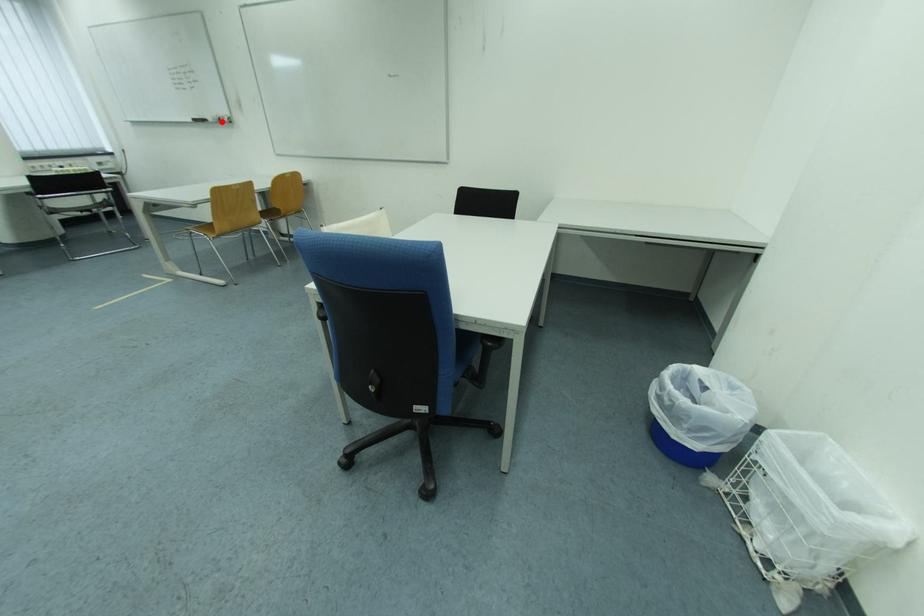
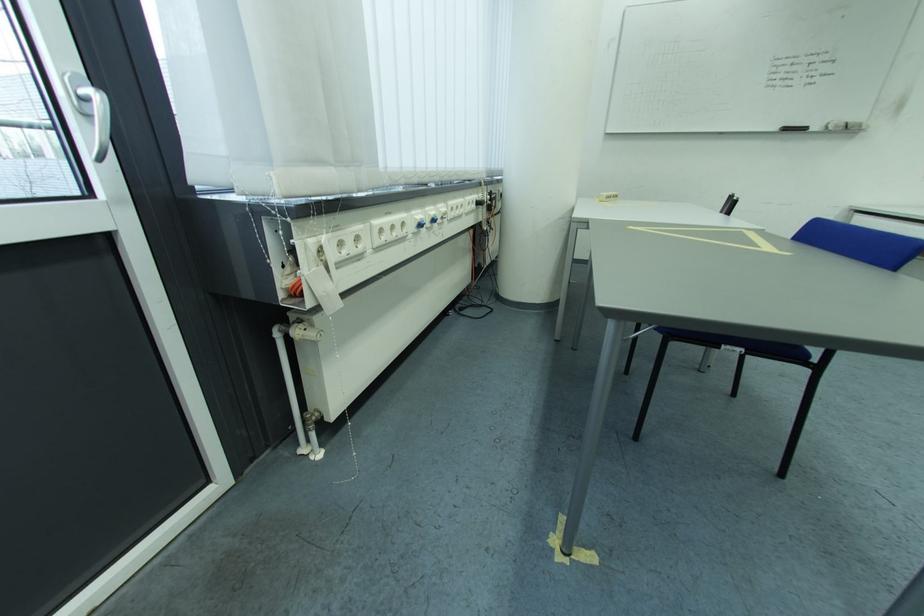
Find the pixel in the second image that matches the highlighted location in the first image.

(845, 129)